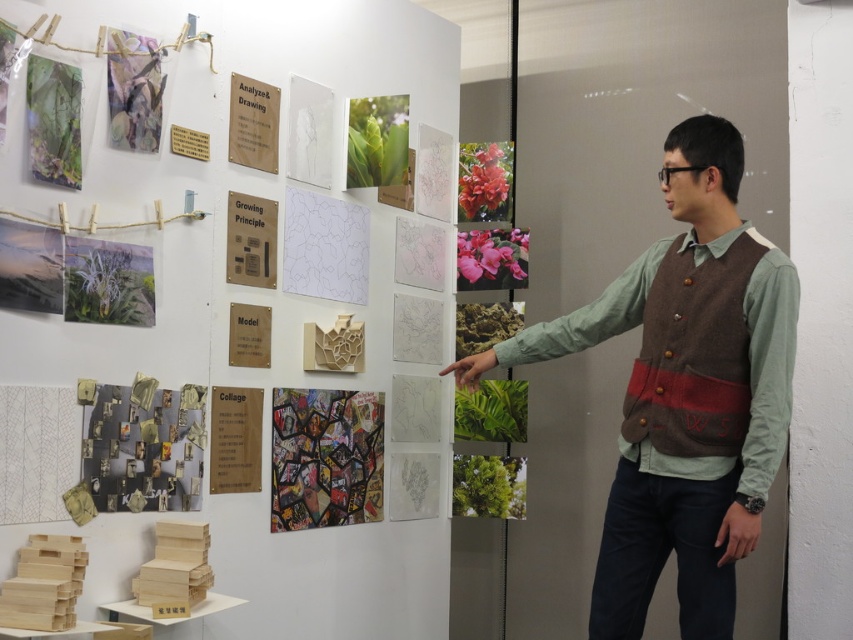
You are an art student attending a presentation in the room. You notice the recycled paper collage at lower left and the vivid pink petals at upper right. Which object is closer to you from your current position in the room?

The recycled paper collage at lower left is closer to you because it is in front of the vivid pink petals at upper right.

You are an art student attending a presentation in the room. The presenter asks you to locate the matte paper collage at upper left. Can you confirm its exact coordinates on the wall? Please provide the coordinates as a pair of numbers separated by a comma.

The matte paper collage at upper left is located at coordinates (132, 92).

You are an art student trying to take notes on the wall display. You need to write down the title of the matte paper collage at upper left and the green matte plant at lower center. Which object should you look at first if you want to start from the left side of the display?

You should look at the matte paper collage at upper left first because it is positioned to the left of the green matte plant at lower center.